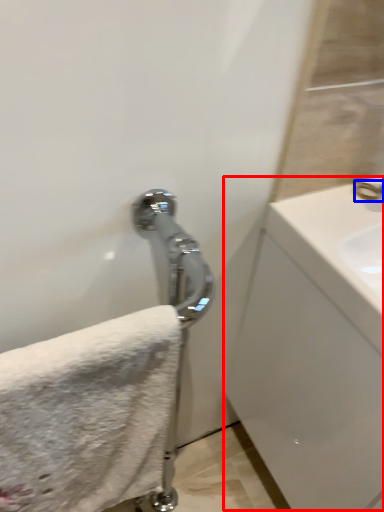
Question: Which point is closer to the camera, counter top (highlighted by a red box) or faucet (highlighted by a blue box)?

Choices:
 (A) counter top
 (B) faucet

Answer: (A)